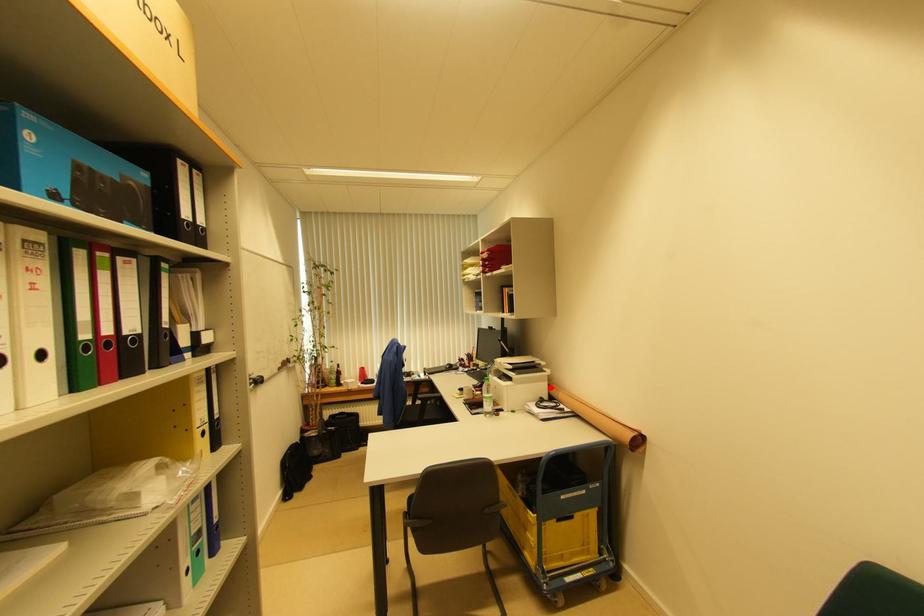
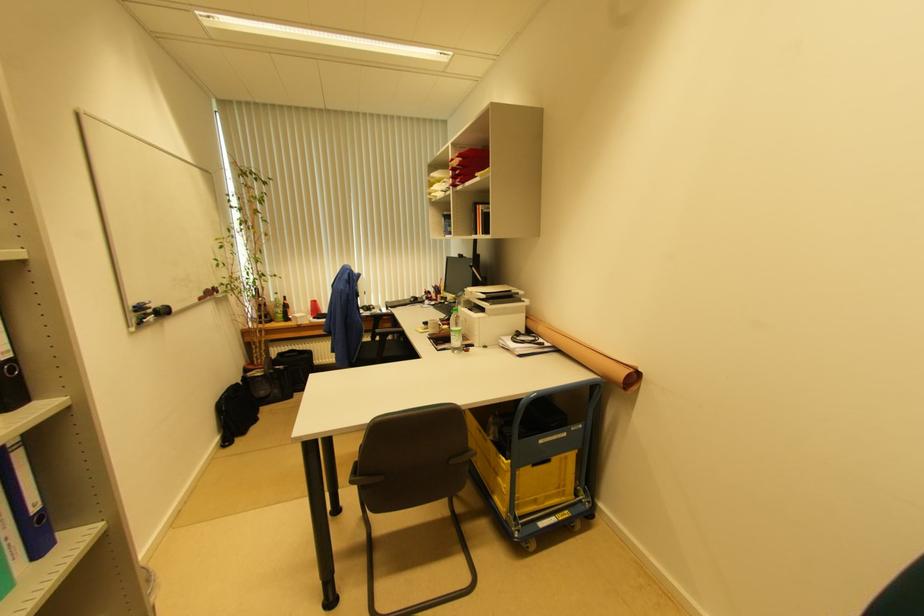
In the second image, find the point that corresponds to the highlighted location in the first image.

(528, 320)